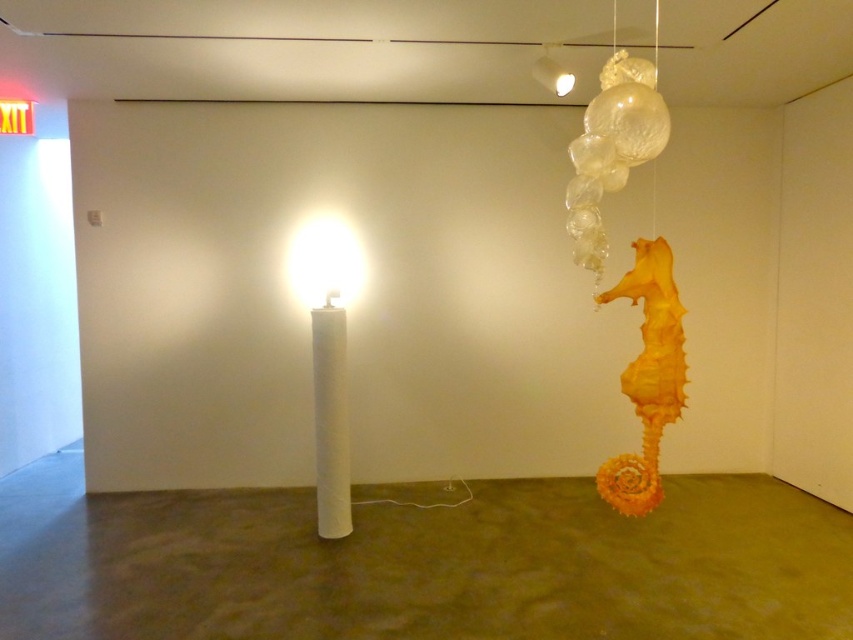
Question: Among these points, which one is farthest from the camera?

Choices:
 (A) (337, 317)
 (B) (634, 148)

Answer: (A)

Question: Is the position of translucent glass seahorse at upper right less distant than that of matte white lamp at center?

Choices:
 (A) no
 (B) yes

Answer: (B)

Question: Which of the following is the closest to the observer?

Choices:
 (A) (352, 276)
 (B) (294, 248)
 (C) (335, 474)

Answer: (C)

Question: Which of these objects is positioned farthest from the matte white lamp at center?

Choices:
 (A) white matte cylinder at center
 (B) translucent glass seahorse at upper right
 (C) white glossy cylinder at center

Answer: (B)

Question: Does white glossy cylinder at center appear on the left side of white matte cylinder at center?

Choices:
 (A) no
 (B) yes

Answer: (A)

Question: Is translucent glass seahorse at upper right thinner than matte white lamp at center?

Choices:
 (A) no
 (B) yes

Answer: (B)